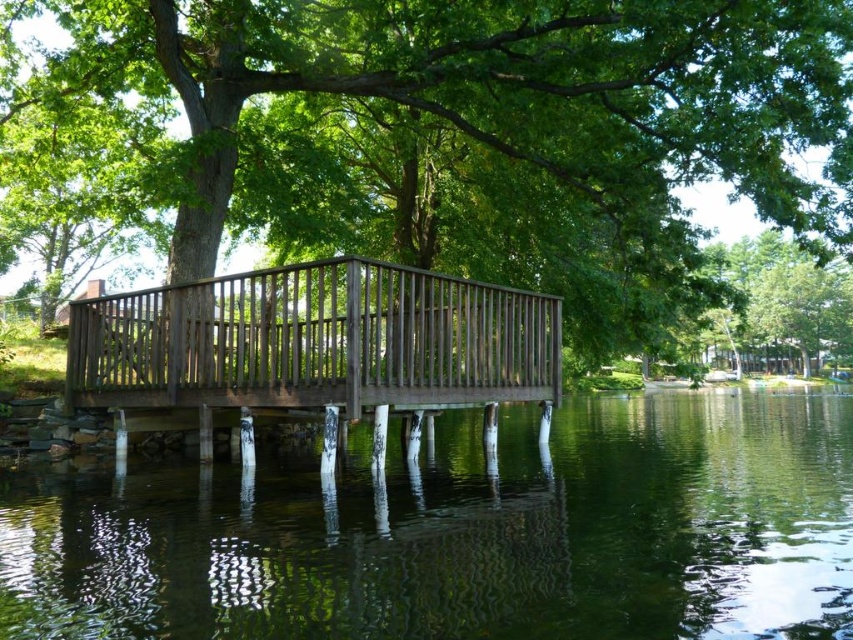
Question: Which of the following is the closest to the observer?

Choices:
 (A) (90, 387)
 (B) (358, 67)
 (C) (786, 465)

Answer: (C)

Question: Which point is closer to the camera taking this photo?

Choices:
 (A) (834, 342)
 (B) (699, 518)

Answer: (B)

Question: Considering the real-world distances, which object is closest to the green wood tree at center?

Choices:
 (A) green reflective water at center
 (B) green leafy tree at upper right
 (C) dark brown wood rail at center

Answer: (C)

Question: Is dark brown wood rail at center further to the viewer compared to green leafy tree at upper right?

Choices:
 (A) no
 (B) yes

Answer: (A)

Question: Is green reflective water at center bigger than green leafy tree at upper right?

Choices:
 (A) no
 (B) yes

Answer: (A)

Question: Can you confirm if green reflective water at center is bigger than dark brown wood rail at center?

Choices:
 (A) no
 (B) yes

Answer: (A)